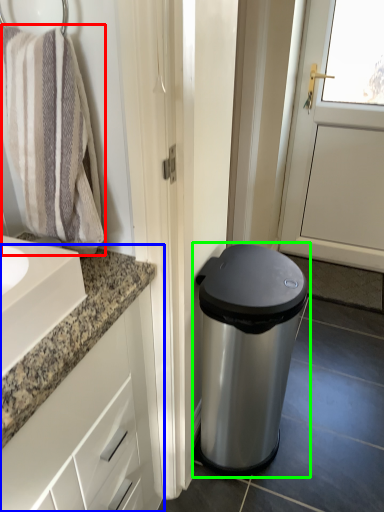
Question: Based on their relative distances, which object is nearer to bath towel (highlighted by a red box)? Choose from bathroom cabinet (highlighted by a blue box) and waste container (highlighted by a green box).

Choices:
 (A) bathroom cabinet
 (B) waste container

Answer: (A)